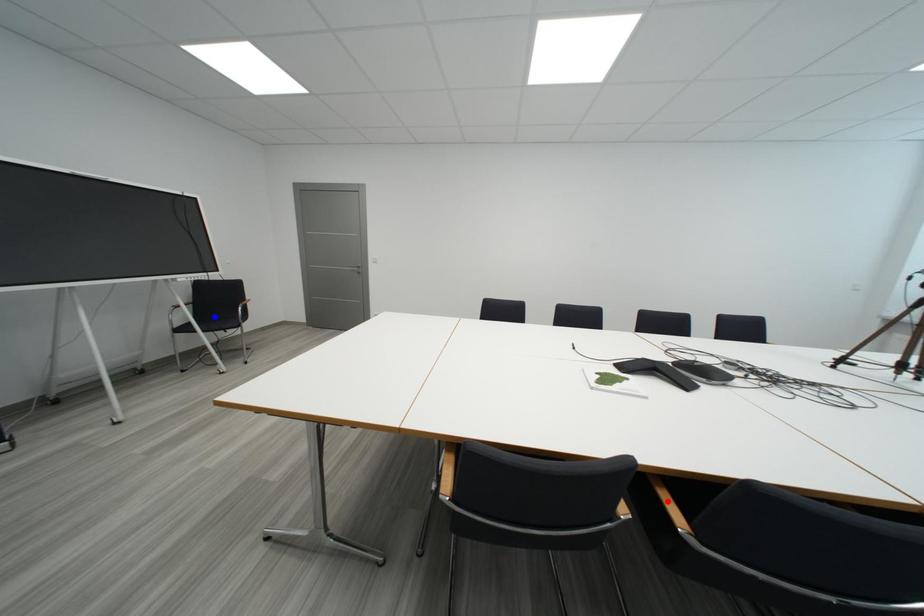
Question: In the image, two points are highlighted. Which point is nearer to the camera? Reply with the corresponding letter.

Choices:
 (A) blue point
 (B) red point

Answer: (B)